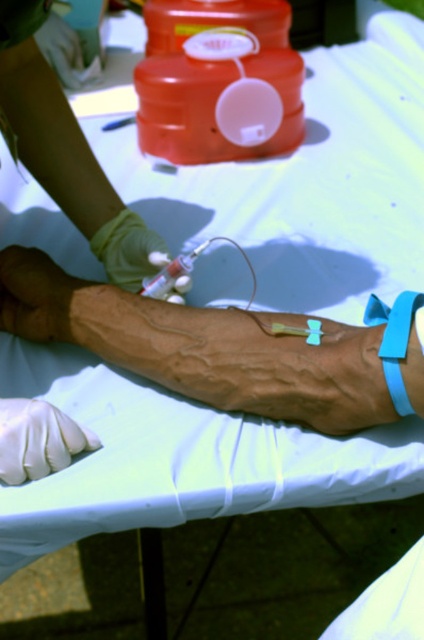
You are a medical student observing the procedure. The green rubber glove at center and the translucent plastic syringe at center are both on the table. If you need to place a 10cm wide medical tool between them, will there be enough space?

The green rubber glove at center might be wider than translucent plastic syringe at center, so the space between them may or may not accommodate a 10cm wide tool. It is uncertain without exact measurements.

You are a medical student observing a blood draw procedure. You notice the green rubber glove at center and the translucent plastic syringe at center. Which object is closer to you?

The green rubber glove at center is closer to you because the translucent plastic syringe at center is behind it.

You are a medical student observing a blood draw procedure. You notice a point marked at coordinates [128,250]. What object is located at that point?

The green rubber glove at center is located at point [128,250].